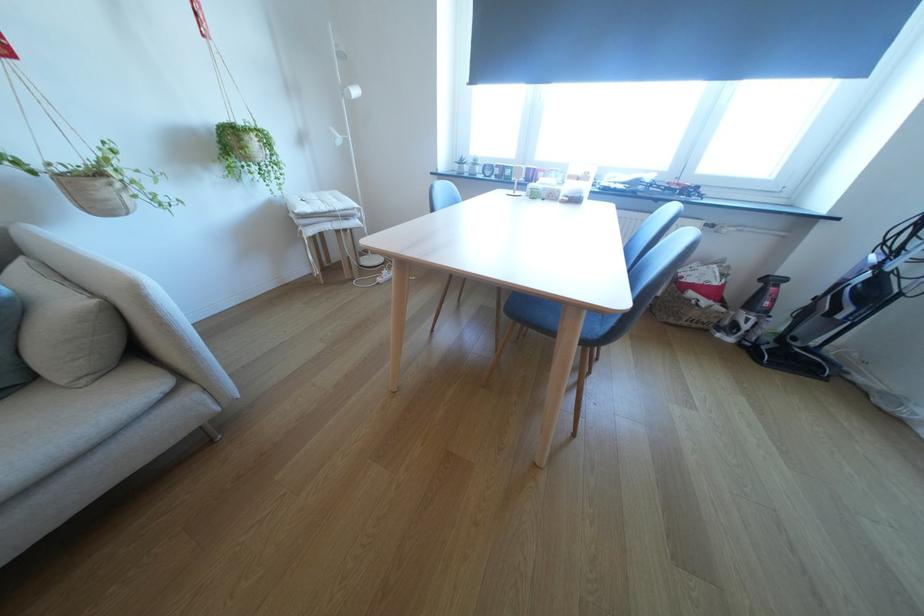
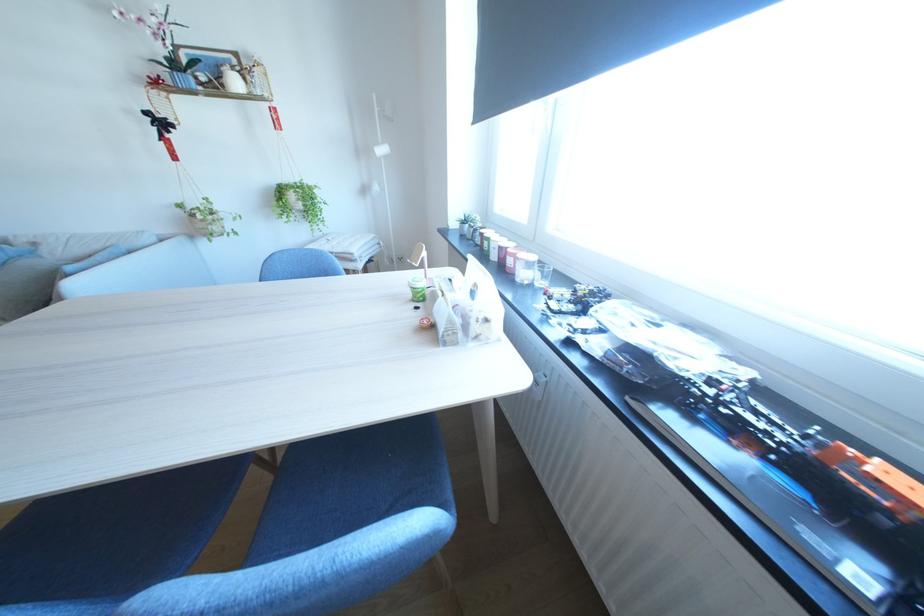
The point at (x=600, y=174) is marked in the first image. Where is the corresponding point in the second image?

(489, 288)